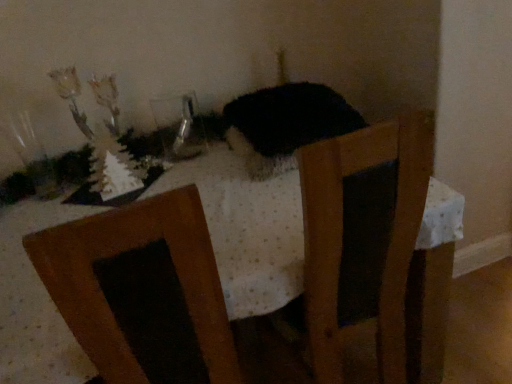
Question: From a real-world perspective, is white dotted fabric at center below transparent glass vase at upper left?

Choices:
 (A) no
 (B) yes

Answer: (B)

Question: Considering the relative sizes of white dotted fabric at center and transparent glass vase at upper left in the image provided, is white dotted fabric at center thinner than transparent glass vase at upper left?

Choices:
 (A) yes
 (B) no

Answer: (B)

Question: Is white dotted fabric at center at the right side of transparent glass vase at upper left?

Choices:
 (A) no
 (B) yes

Answer: (B)

Question: Considering the relative sizes of white dotted fabric at center and transparent glass vase at upper left in the image provided, is white dotted fabric at center shorter than transparent glass vase at upper left?

Choices:
 (A) yes
 (B) no

Answer: (B)

Question: From the image's perspective, does white dotted fabric at center appear lower than transparent glass vase at upper left?

Choices:
 (A) yes
 (B) no

Answer: (A)

Question: Is white dotted fabric at center wider than transparent glass vase at upper left?

Choices:
 (A) no
 (B) yes

Answer: (B)

Question: Can you confirm if fuzzy black cat at center is taller than transparent glass vase at upper left?

Choices:
 (A) yes
 (B) no

Answer: (B)

Question: Can we say fuzzy black cat at center lies outside transparent glass vase at upper left?

Choices:
 (A) yes
 (B) no

Answer: (A)

Question: Is fuzzy black cat at center bigger than transparent glass vase at upper left?

Choices:
 (A) no
 (B) yes

Answer: (B)

Question: From the image's perspective, would you say fuzzy black cat at center is positioned over transparent glass vase at upper left?

Choices:
 (A) yes
 (B) no

Answer: (A)

Question: Is fuzzy black cat at center wider than transparent glass vase at upper left?

Choices:
 (A) no
 (B) yes

Answer: (B)

Question: Is transparent glass vase at upper left a part of fuzzy black cat at center?

Choices:
 (A) yes
 (B) no

Answer: (B)

Question: Is white dotted fabric at center further to the viewer compared to fuzzy black cat at center?

Choices:
 (A) yes
 (B) no

Answer: (B)